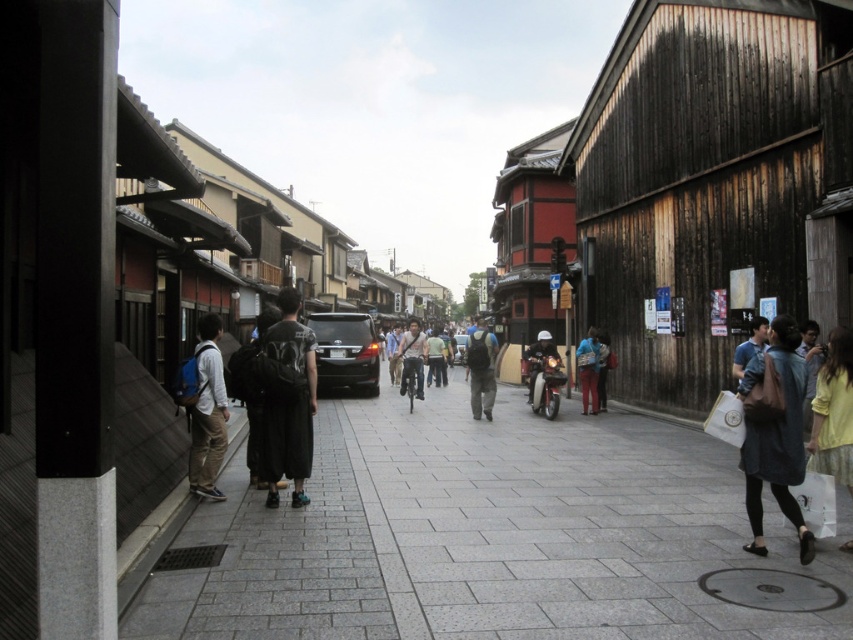
Question: Based on their relative distances, which object is farther from the matte black helmet at center?

Choices:
 (A) gray concrete pavement at lower left
 (B) matte gray backpack at center

Answer: (A)

Question: Can you confirm if gray concrete pavement at lower left is positioned to the left of denim jacket at lower right?

Choices:
 (A) yes
 (B) no

Answer: (A)

Question: Is gray concrete pavement at lower left bigger than light brown fabric pants at left?

Choices:
 (A) yes
 (B) no

Answer: (A)

Question: Among these objects, which one is nearest to the camera?

Choices:
 (A) matte gray backpack at center
 (B) matte black helmet at center

Answer: (A)

Question: Which of the following is the closest to the observer?

Choices:
 (A) (274, 500)
 (B) (837, 419)

Answer: (B)

Question: Is gray concrete pavement at lower left further to camera compared to blue denim jeans at lower right?

Choices:
 (A) no
 (B) yes

Answer: (A)